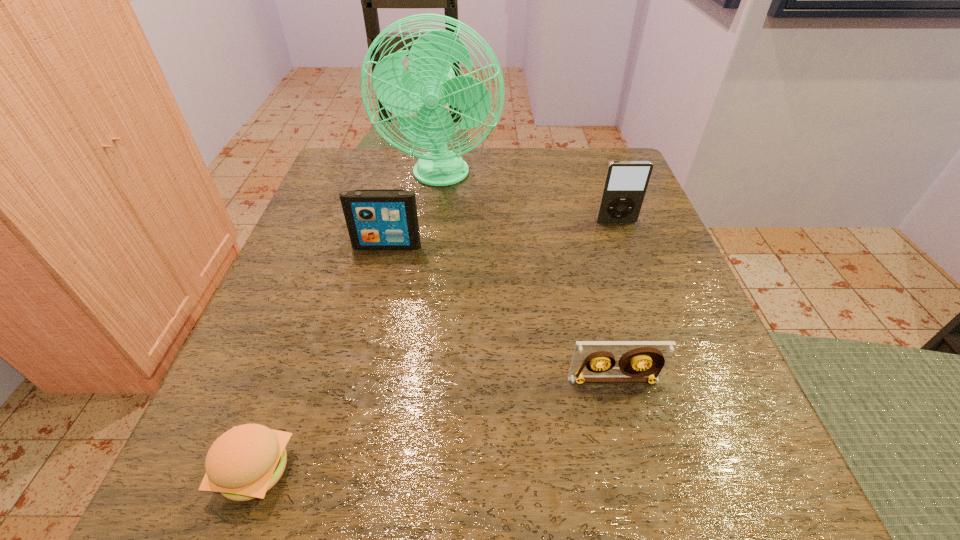
At what (x,y) coordinates should I click in order to perform the action: click on the farthest object. Please return your answer as a coordinate pair (x, y). The width and height of the screenshot is (960, 540). Looking at the image, I should click on (430, 83).

The image size is (960, 540). In order to click on fan in this screenshot , I will do `click(430, 83)`.

At what (x,y) coordinates should I click in order to perform the action: click on the farther iPod. Please return your answer as a coordinate pair (x, y). Image resolution: width=960 pixels, height=540 pixels. Looking at the image, I should click on (625, 184).

Where is `the right iPod`? the right iPod is located at coordinates (625, 184).

Locate an element on the screen. This screenshot has height=540, width=960. the nearer iPod is located at coordinates (377, 219).

Find the location of `the third nearest object`. the third nearest object is located at coordinates (377, 219).

Image resolution: width=960 pixels, height=540 pixels. I want to click on the fourth tallest object, so click(642, 361).

I want to click on the fourth farthest object, so click(642, 361).

This screenshot has width=960, height=540. What are the coordinates of `the nearest object` in the screenshot? It's located at (245, 462).

Find the location of a particular element. This screenshot has height=540, width=960. hamburger is located at coordinates (245, 462).